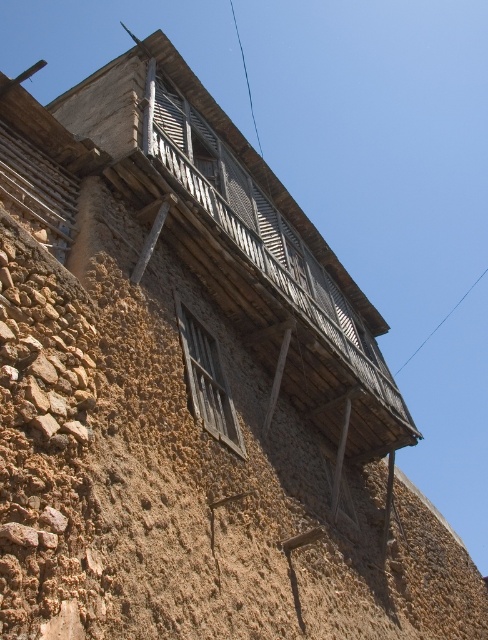
Question: Can you confirm if brown rough stone wall at center is thinner than wooden at upper center?

Choices:
 (A) no
 (B) yes

Answer: (A)

Question: Can you confirm if brown rough stone wall at center is positioned to the right of wooden at upper center?

Choices:
 (A) yes
 (B) no

Answer: (A)

Question: Which of the following is the closest to the observer?

Choices:
 (A) (192, 381)
 (B) (222, 372)

Answer: (A)

Question: Considering the relative positions of brown rough stone wall at center and wooden at upper center in the image provided, where is brown rough stone wall at center located with respect to wooden at upper center?

Choices:
 (A) above
 (B) below

Answer: (B)